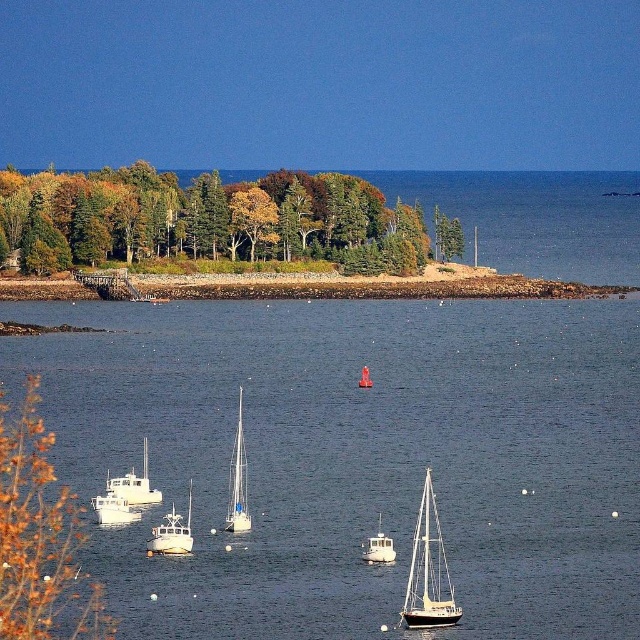
Measure the distance between green leafy trees at upper left and camera.

green leafy trees at upper left is 217.64 meters from camera.

Identify the location of green leafy trees at upper left. The image size is (640, 640). (204, 220).

Where is `green leafy trees at upper left`? green leafy trees at upper left is located at coordinates (204, 220).

Image resolution: width=640 pixels, height=640 pixels. What do you see at coordinates (428, 570) in the screenshot?
I see `white glossy sailboat at lower center` at bounding box center [428, 570].

From the picture: Which is more to the right, white glossy sailboat at lower center or white glossy sailboat at center?

white glossy sailboat at lower center

You are a GUI agent. You are given a task and a screenshot of the screen. Output one action in this format:
    pyautogui.click(x=<x>, y=<y>)
    Task: Click on the white glossy sailboat at lower center
    This screenshot has width=640, height=640.
    Given the screenshot: What is the action you would take?
    pyautogui.click(x=428, y=570)

Can you confirm if white glossy sailboat at center is taller than white matte sailboat at lower left?

Yes, white glossy sailboat at center is taller than white matte sailboat at lower left.

Is white glossy sailboat at center shorter than white matte sailboat at lower left?

No.

The height and width of the screenshot is (640, 640). What do you see at coordinates (237, 481) in the screenshot? I see `white glossy sailboat at center` at bounding box center [237, 481].

Locate an element on the screen. This screenshot has width=640, height=640. white glossy sailboat at center is located at coordinates (237, 481).